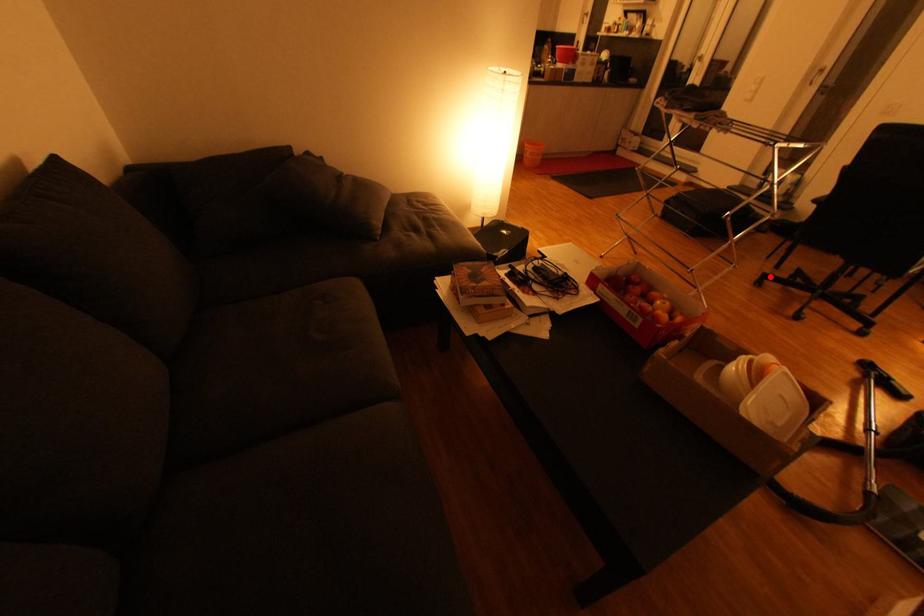
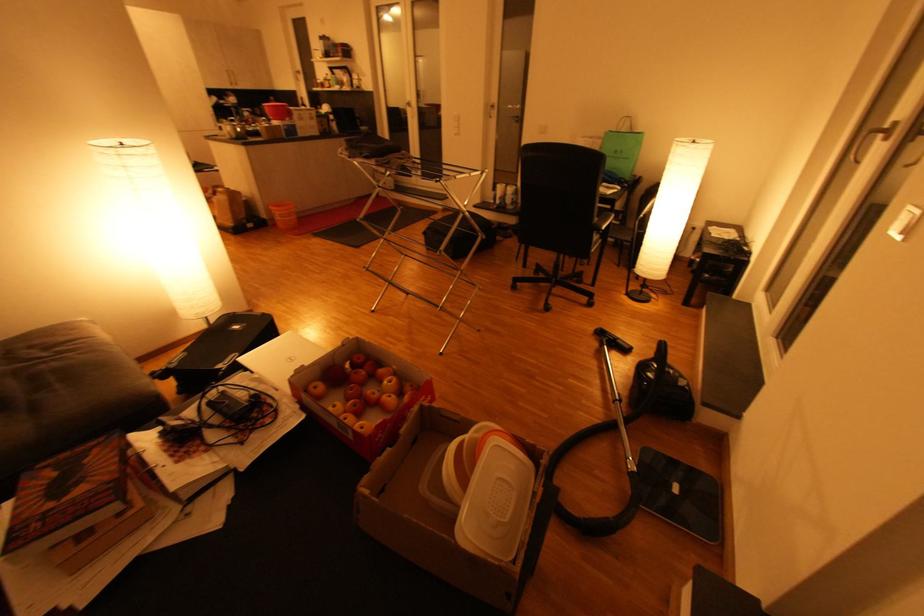
Question: I am providing you with two images of the same scene from different viewpoints. A red point is shown in image1. For the corresponding object point in image2, is it positioned nearer or farther from the camera?

Choices:
 (A) Nearer
 (B) Farther

Answer: (A)